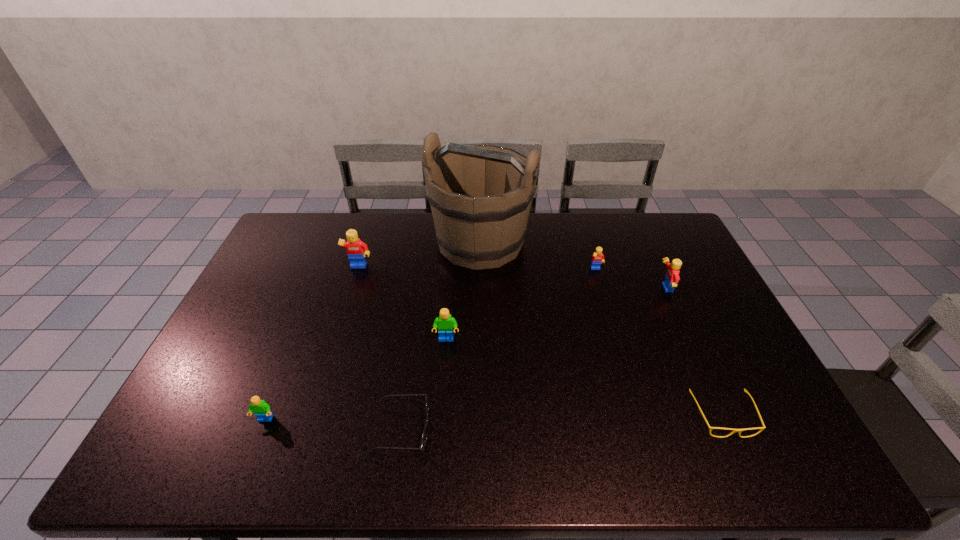
At what (x,y) coordinates should I click in order to perform the action: click on vacant space located on the front-facing side of the left spectacles. Please return your answer as a coordinate pair (x, y). This screenshot has height=540, width=960. Looking at the image, I should click on (594, 430).

In order to click on object at the far edge in this screenshot , I will do `click(480, 196)`.

Identify the location of Lego present at the right edge. (672, 277).

You are a GUI agent. You are given a task and a screenshot of the screen. Output one action in this format:
    pyautogui.click(x=<x>, y=<y>)
    Task: Click on the spectacles located at the right edge
    Image resolution: width=960 pixels, height=540 pixels.
    Given the screenshot: What is the action you would take?
    pyautogui.click(x=711, y=428)

Find the location of `object positioned at the near right corner`. object positioned at the near right corner is located at coordinates pos(711,428).

This screenshot has height=540, width=960. I want to click on vacant region at the far edge, so click(x=629, y=225).

The width and height of the screenshot is (960, 540). I want to click on vacant space at the near edge of the desktop, so click(565, 450).

In the image, there is a desktop. In order to click on blank space at the left edge in this screenshot , I will do `click(276, 295)`.

This screenshot has height=540, width=960. What are the coordinates of `free space at the far left corner of the desktop` in the screenshot? It's located at (314, 230).

This screenshot has width=960, height=540. In order to click on free space at the near right corner of the desktop in this screenshot , I will do `click(762, 438)`.